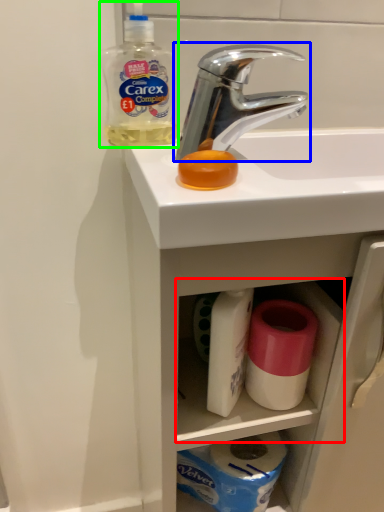
Question: Which is nearer to the cabinet (highlighted by a red box)? tap (highlighted by a blue box) or cleaning product (highlighted by a green box).

Choices:
 (A) tap
 (B) cleaning product

Answer: (A)